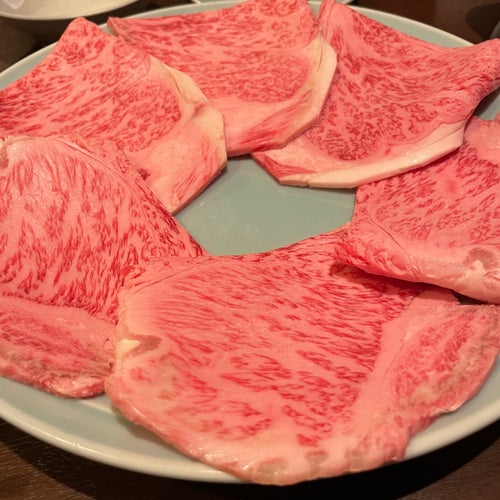
Where is `wooden table`? The image size is (500, 500). wooden table is located at coordinates (33, 475).